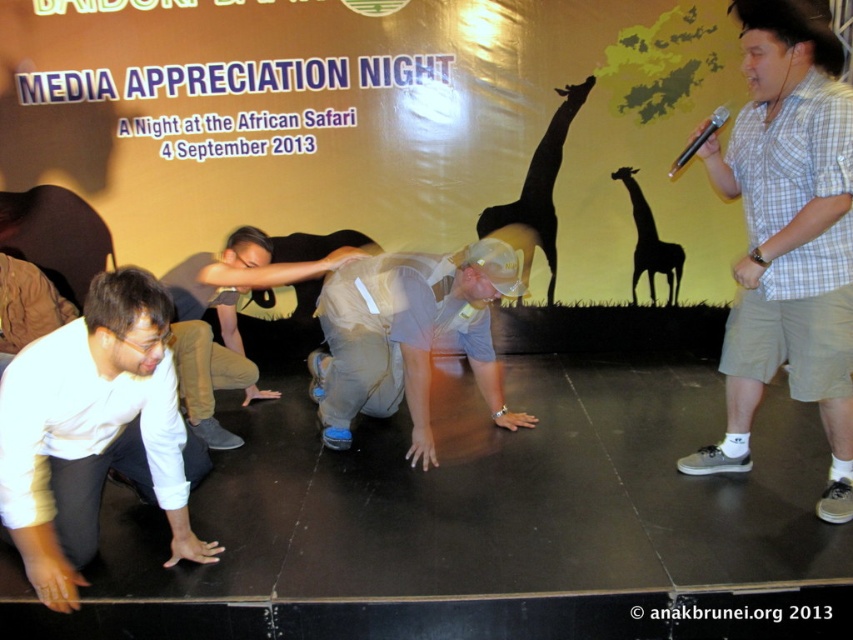
Question: Does gray fabric shirt at center appear on the left side of black matte giraffe at center?

Choices:
 (A) yes
 (B) no

Answer: (A)

Question: Which object appears farthest from the camera in this image?

Choices:
 (A) white plastic bag at center
 (B) gray fabric shirt at center
 (C) black rubber stage at center

Answer: (A)

Question: Which point is closer to the camera taking this photo?

Choices:
 (A) (381, 362)
 (B) (3, 509)

Answer: (B)

Question: Which object is closer to the camera taking this photo?

Choices:
 (A) white matte shirt at lower left
 (B) white checkered shirt at upper right
 (C) white plastic bag at center

Answer: (A)

Question: Considering the relative positions of white fabric bag at center and white plastic bag at center in the image provided, where is white fabric bag at center located with respect to white plastic bag at center?

Choices:
 (A) left
 (B) right

Answer: (A)

Question: Where is white checkered shirt at upper right located in relation to white plastic bag at center in the image?

Choices:
 (A) left
 (B) right

Answer: (B)